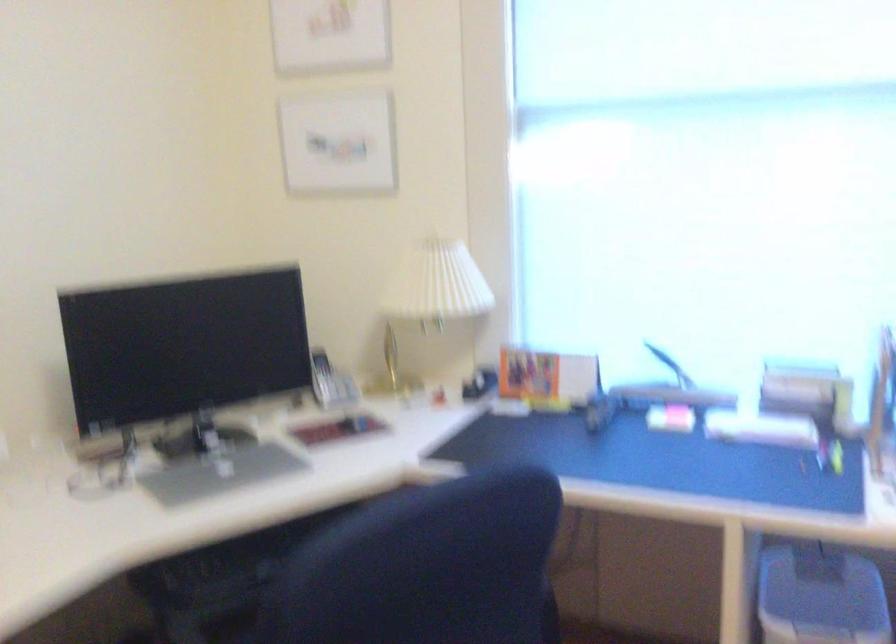
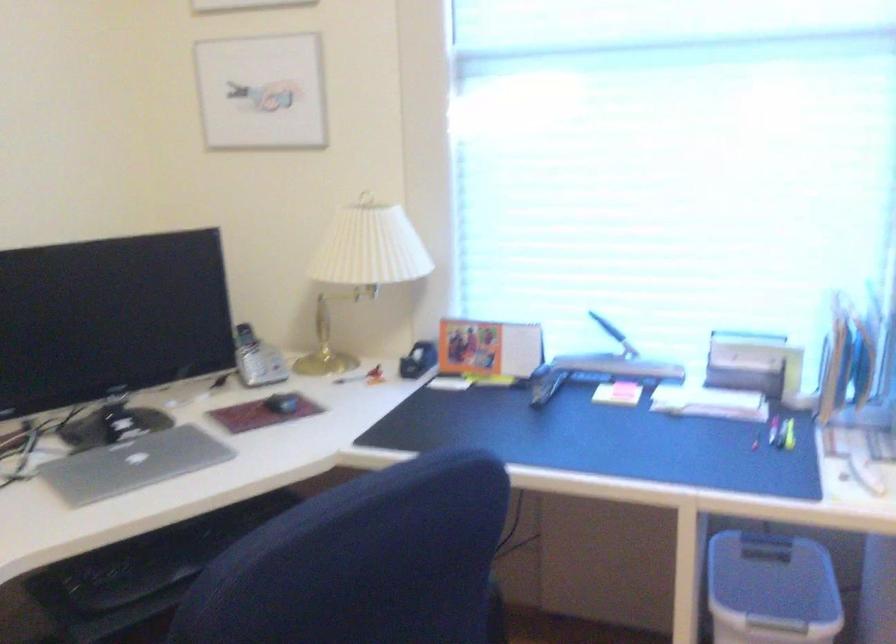
Locate, in the second image, the point that corresponds to (x=479, y=386) in the first image.

(418, 360)